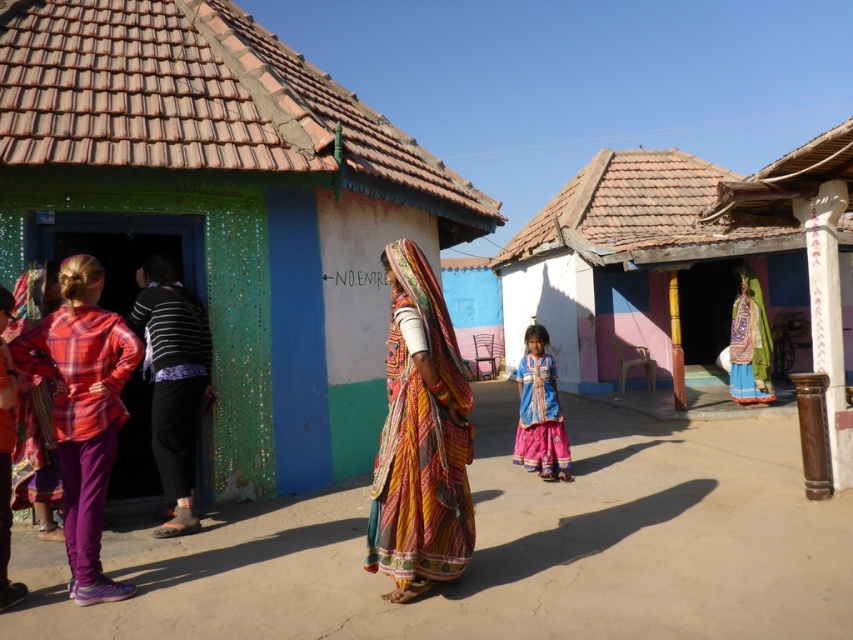
Can you confirm if blue painted wall at left is thinner than plaid fabric shirt at left?

No, blue painted wall at left is not thinner than plaid fabric shirt at left.

Who is higher up, blue painted wall at left or plaid fabric shirt at left?

blue painted wall at left

Who is more distant from viewer, (164, 38) or (102, 408)?

The point (164, 38) is more distant.

I want to click on blue painted wall at left, so click(x=225, y=209).

Does point (80, 260) come behind point (834, 260)?

No.

Does plaid fabric shirt at left lie in front of wooden column at right?

That is True.

Locate an element on the screen. The height and width of the screenshot is (640, 853). plaid fabric shirt at left is located at coordinates (83, 412).

Which is more to the left, striped fabric dress at left or blue cotton dress at center?

Positioned to the left is striped fabric dress at left.

Is striped fabric dress at left positioned behind blue cotton dress at center?

No, it is not.

Who is more forward, (160, 348) or (519, 451)?

Positioned in front is point (160, 348).

Identify the location of striped fabric dress at left. This screenshot has height=640, width=853. (173, 381).